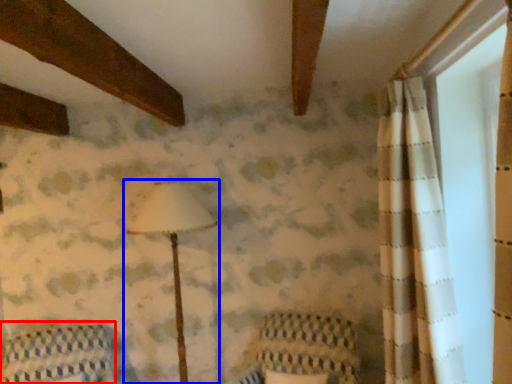
Question: Which of the following is the closest to the observer, furniture (highlighted by a red box) or lamp (highlighted by a blue box)?

Choices:
 (A) furniture
 (B) lamp

Answer: (A)